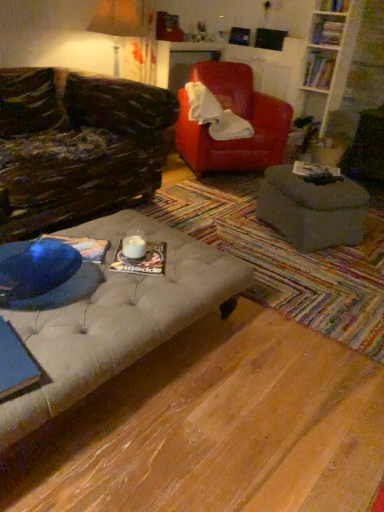
The width and height of the screenshot is (384, 512). Describe the element at coordinates (36, 268) in the screenshot. I see `transparent glass table at lower left` at that location.

Locate an element on the screen. The height and width of the screenshot is (512, 384). blue paper at center, acting as the 2th book starting from the bottom is located at coordinates (83, 246).

Describe the element at coordinates (314, 169) in the screenshot. I see `hardcover book at center, the fourth book when ordered from back to front` at that location.

The image size is (384, 512). What do you see at coordinates (287, 259) in the screenshot?
I see `tufted fabric ottoman at center` at bounding box center [287, 259].

Locate an element on the screen. Image resolution: width=384 pixels, height=512 pixels. matte paper book at center, arranged as the second book when viewed from the left is located at coordinates (142, 260).

From a real-world perspective, between hardcover book at upper right, the third book when ordered from top to bottom, and hardcover book at upper right, which ranks as the 3th book in right-to-left order, who is vertically lower?

hardcover book at upper right, the third book when ordered from top to bottom, from a real-world perspective.

From the image's perspective, which one is positioned higher, hardcover book at upper right, placed as the 1th book when sorted from back to front, or hardcover book at upper right, placed as the 2th book when sorted from back to front?

hardcover book at upper right, placed as the 2th book when sorted from back to front, from the image's perspective.

Considering the sizes of objects hardcover book at upper right, the third book when ordered from top to bottom, and hardcover book at upper right, marked as the second book in a top-to-bottom arrangement, in the image provided, who is bigger, hardcover book at upper right, the third book when ordered from top to bottom, or hardcover book at upper right, marked as the second book in a top-to-bottom arrangement,?

Bigger between the two is hardcover book at upper right, the third book when ordered from top to bottom.

Consider the image. Is hardcover book at upper right, the 6th book viewed from the front, aimed at hardcover book at upper right, which ranks as the 3th book in right-to-left order?

No, hardcover book at upper right, the 6th book viewed from the front, is not oriented towards hardcover book at upper right, which ranks as the 3th book in right-to-left order.

I want to click on chair that appears on the left of hardcover book at upper right, which ranks as the 3th book in right-to-left order, so click(x=236, y=114).

Can you confirm if matte red leather armchair at center is wider than hardcover book at upper right, which ranks as the 3th book in right-to-left order?

Yes.

Is matte red leather armchair at center not near hardcover book at upper right, which ranks as the 3th book in right-to-left order?

matte red leather armchair at center is positioned a significant distance from hardcover book at upper right, which ranks as the 3th book in right-to-left order.

From the image's perspective, which is below, matte red leather armchair at center or hardcover book at upper right, marked as the second book in a top-to-bottom arrangement?

From the image's view, matte red leather armchair at center is below.

Looking at the image, does hardcover book at center, which is the third book from left to right, seem bigger or smaller compared to matte brown lampshade at upper left?

Clearly, hardcover book at center, which is the third book from left to right, is smaller in size than matte brown lampshade at upper left.

Is hardcover book at center, the 3th book ordered from the bottom, oriented away from matte brown lampshade at upper left?

No.

Could matte brown lampshade at upper left be considered to be inside hardcover book at center, the fourth book when ordered from back to front?

No.

Consider the image. Can you confirm if hardcover book at center, positioned as the 4th book in top-to-bottom order, is thinner than matte brown lampshade at upper left?

Correct, the width of hardcover book at center, positioned as the 4th book in top-to-bottom order, is less than that of matte brown lampshade at upper left.

Is matte brown lampshade at upper left next to hardcover book at upper right, the 6th book viewed from the front?

matte brown lampshade at upper left is not next to hardcover book at upper right, the 6th book viewed from the front, and they're not touching.

Who is bigger, matte brown lampshade at upper left or hardcover book at upper right, placed as the 1th book when sorted from back to front?

matte brown lampshade at upper left.

From the image's perspective, is matte brown lampshade at upper left on hardcover book at upper right, the third book when ordered from top to bottom?

Actually, matte brown lampshade at upper left appears below hardcover book at upper right, the third book when ordered from top to bottom, in the image.

Is point (121, 9) behind point (331, 73)?

No, (121, 9) is in front of (331, 73).

Is there a large distance between hardcover book at center, the 3th book ordered from the bottom, and matte red leather armchair at center?

They are positioned close to each other.

Does hardcover book at center, the 3th book ordered from the bottom, turn towards matte red leather armchair at center?

No, hardcover book at center, the 3th book ordered from the bottom, is not turned towards matte red leather armchair at center.

Consider the image. Considering the relative sizes of hardcover book at center, the 3th book in the front-to-back sequence, and matte red leather armchair at center in the image provided, is hardcover book at center, the 3th book in the front-to-back sequence, taller than matte red leather armchair at center?

Incorrect, the height of hardcover book at center, the 3th book in the front-to-back sequence, is not larger of that of matte red leather armchair at center.

In the scene shown: In terms of size, does hardcover book at center, the fourth book when ordered from back to front, appear bigger or smaller than matte red leather armchair at center?

hardcover book at center, the fourth book when ordered from back to front, is smaller than matte red leather armchair at center.

Is matte gray ottoman at center wider or thinner than matte red leather armchair at center?

Considering their sizes, matte gray ottoman at center looks slimmer than matte red leather armchair at center.

Considering their positions, is matte gray ottoman at center located in front of or behind matte red leather armchair at center?

Visually, matte gray ottoman at center is located in front of matte red leather armchair at center.

Does matte gray ottoman at center touch matte red leather armchair at center?

matte gray ottoman at center and matte red leather armchair at center are not in contact.

Which object is wider, hardcover book at upper right, which ranks as the 3th book in right-to-left order, or matte paper book at center, the 1th book positioned from the bottom?

Wider between the two is matte paper book at center, the 1th book positioned from the bottom.

From a real-world perspective, which object stands above the other?

In real-world perspective, hardcover book at upper right, the fifth book positioned from the bottom, is above.

Where is `book that is the 2nd object to the right of the matte paper book at center, arranged as the second book when viewed from the left, starting at the anchor`? Image resolution: width=384 pixels, height=512 pixels. book that is the 2nd object to the right of the matte paper book at center, arranged as the second book when viewed from the left, starting at the anchor is located at coordinates (327, 30).

Which object is further away from the camera taking this photo, hardcover book at upper right, which ranks as the fourth book in left-to-right order, or matte paper book at center, the 1th book positioned from the bottom?

hardcover book at upper right, which ranks as the fourth book in left-to-right order, is further away from the camera.

Which book is the 1st one when counting from the right side of the hardcover book at upper right, which is the fifth book in front-to-back order? Please provide its 2D coordinates.

[(319, 70)]

Where is `the 2nd book above when counting from the matte red leather armchair at center (from the image's perspective)`? The image size is (384, 512). the 2nd book above when counting from the matte red leather armchair at center (from the image's perspective) is located at coordinates (327, 30).

Based on their spatial positions, is hardcover book at upper right, placed as the fifth book when sorted from left to right, or matte brown lampshade at upper left further from hardcover book at upper right, the first book when ordered from right to left?

matte brown lampshade at upper left.

Based on their spatial positions, is transparent glass table at lower left or hardcover book at upper right, which is counted as the sixth book, starting from the left, closer to matte brown lampshade at upper left?

Based on the image, hardcover book at upper right, which is counted as the sixth book, starting from the left, appears to be nearer to matte brown lampshade at upper left.

Considering their positions, is hardcover book at upper right, the 6th book viewed from the front, positioned further to matte paper book at center, which is the 5th book from right to left, than tufted fabric ottoman at center?

hardcover book at upper right, the 6th book viewed from the front, is positioned further to the anchor matte paper book at center, which is the 5th book from right to left.

Consider the image. Which object lies further to the anchor point tufted fabric ottoman at center, matte gray ottoman at center or hardcover book at center, the 3th book in the front-to-back sequence?

The object further to tufted fabric ottoman at center is hardcover book at center, the 3th book in the front-to-back sequence.

When comparing their distances from blue paper at center, the sixth book in the right-to-left sequence, does tufted fabric ottoman at center or matte brown lampshade at upper left seem further?

Among the two, matte brown lampshade at upper left is located further to blue paper at center, the sixth book in the right-to-left sequence.

When comparing their distances from hardcover book at upper right, the first book when ordered from right to left, does hardcover book at upper right, marked as the second book in a top-to-bottom arrangement, or transparent glass table at lower left seem further?

The object further to hardcover book at upper right, the first book when ordered from right to left, is transparent glass table at lower left.

Which object lies nearer to the anchor point blue paper at center, the fifth book when ordered from top to bottom, matte paper book at center, which appears as the first book when viewed from the front, or hardcover book at center, which is the third book from left to right?

matte paper book at center, which appears as the first book when viewed from the front.

Which object lies nearer to the anchor point matte red leather armchair at center, tufted fabric ottoman at center or matte gray ottoman at center?

tufted fabric ottoman at center is positioned closer to the anchor matte red leather armchair at center.

This screenshot has width=384, height=512. Identify the location of table between matte brown lampshade at upper left and hardcover book at upper right, the third book when ordered from top to bottom, from left to right. (312, 209).

Where is `table that lies between hardcover book at upper right, marked as the second book in a top-to-bottom arrangement, and matte paper book at center, the sixth book from the top, from top to bottom`? This screenshot has width=384, height=512. table that lies between hardcover book at upper right, marked as the second book in a top-to-bottom arrangement, and matte paper book at center, the sixth book from the top, from top to bottom is located at coordinates (312, 209).

I want to click on book between hardcover book at upper right, the fourth book positioned from the front, and hardcover book at upper right, arranged as the fourth book when ordered from the bottom, in the up-down direction, so click(327, 30).

Locate an element on the screen. Image resolution: width=384 pixels, height=512 pixels. table between matte brown lampshade at upper left and hardcover book at upper right, the fifth book positioned from the bottom, from left to right is located at coordinates (312, 209).